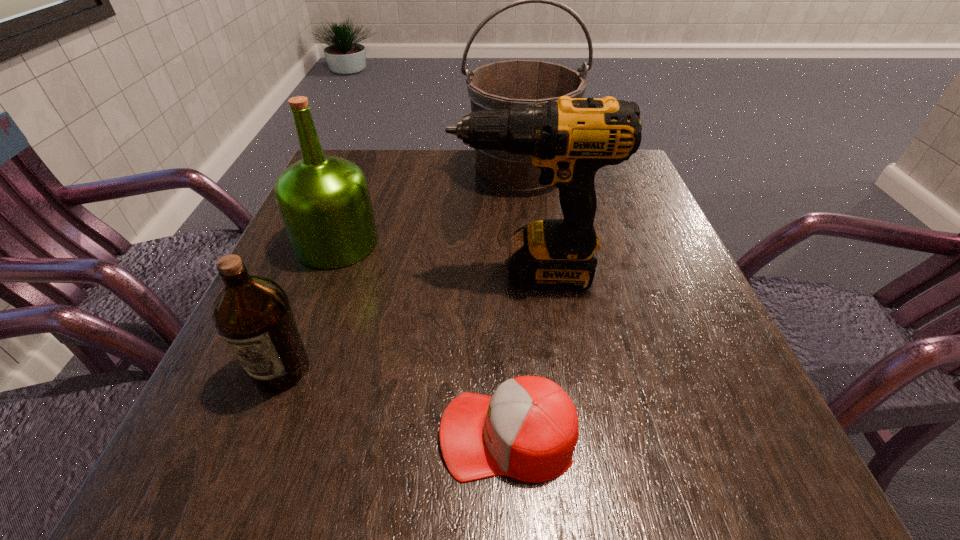
Locate an element on the screen. This screenshot has height=540, width=960. vacant area that lies between the shorter olive oil and the taller olive oil is located at coordinates (309, 307).

At what (x,y) coordinates should I click in order to perform the action: click on unoccupied position between the fourth tallest object and the taller olive oil. Please return your answer as a coordinate pair (x, y). Image resolution: width=960 pixels, height=540 pixels. Looking at the image, I should click on (309, 307).

Identify the location of vacant space in between the drill and the farthest object. The image size is (960, 540). (524, 223).

Identify the location of empty location between the drill and the baseball cap. (517, 354).

Where is `free space between the drill and the shortest object`? This screenshot has width=960, height=540. free space between the drill and the shortest object is located at coordinates (517, 354).

Image resolution: width=960 pixels, height=540 pixels. I want to click on vacant space that is in between the taller olive oil and the nearer olive oil, so click(x=309, y=307).

Select which object is the closest to the shorter olive oil. Please provide its 2D coordinates. Your answer should be formatted as a tuple, i.e. [(x, y)], where the tuple contains the x and y coordinates of a point satisfying the conditions above.

[(324, 201)]

The height and width of the screenshot is (540, 960). In order to click on object that is the third nearest to the nearer olive oil in this screenshot , I will do `click(569, 139)`.

The width and height of the screenshot is (960, 540). Find the location of `free space that satisfies the following two spatial constraints: 1. at the tip of the drill; 2. on the label of the second shortest object`. free space that satisfies the following two spatial constraints: 1. at the tip of the drill; 2. on the label of the second shortest object is located at coordinates (539, 370).